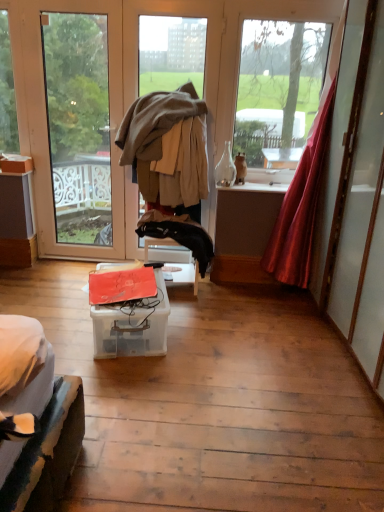
Question: Does transparent glass door at left, marked as the second window in a right-to-left arrangement, come in front of satin red curtain at right?

Choices:
 (A) yes
 (B) no

Answer: (B)

Question: From the image's perspective, is transparent glass door at left, marked as the second window in a right-to-left arrangement, over satin red curtain at right?

Choices:
 (A) yes
 (B) no

Answer: (A)

Question: Is transparent glass door at left, which is counted as the first window, starting from the left, wider than satin red curtain at right?

Choices:
 (A) no
 (B) yes

Answer: (A)

Question: Considering the relative sizes of transparent glass door at left, marked as the second window in a right-to-left arrangement, and satin red curtain at right in the image provided, is transparent glass door at left, marked as the second window in a right-to-left arrangement, taller than satin red curtain at right?

Choices:
 (A) no
 (B) yes

Answer: (B)

Question: Is satin red curtain at right located within transparent glass door at left, marked as the second window in a right-to-left arrangement?

Choices:
 (A) yes
 (B) no

Answer: (B)

Question: Can you confirm if transparent glass door at left, marked as the second window in a right-to-left arrangement, is smaller than satin red curtain at right?

Choices:
 (A) no
 (B) yes

Answer: (B)

Question: Does satin red curtain at right have a smaller size compared to black fabric jacket at center?

Choices:
 (A) no
 (B) yes

Answer: (A)

Question: Can you confirm if satin red curtain at right is thinner than black fabric jacket at center?

Choices:
 (A) no
 (B) yes

Answer: (A)

Question: Considering the relative sizes of satin red curtain at right and black fabric jacket at center in the image provided, is satin red curtain at right shorter than black fabric jacket at center?

Choices:
 (A) yes
 (B) no

Answer: (B)

Question: Is satin red curtain at right taller than black fabric jacket at center?

Choices:
 (A) no
 (B) yes

Answer: (B)

Question: From a real-world perspective, is satin red curtain at right below black fabric jacket at center?

Choices:
 (A) yes
 (B) no

Answer: (B)

Question: Is black fabric jacket at center a part of satin red curtain at right?

Choices:
 (A) yes
 (B) no

Answer: (B)

Question: Does black fabric jacket at center have a lesser width compared to beige woolen jacket at center?

Choices:
 (A) no
 (B) yes

Answer: (B)